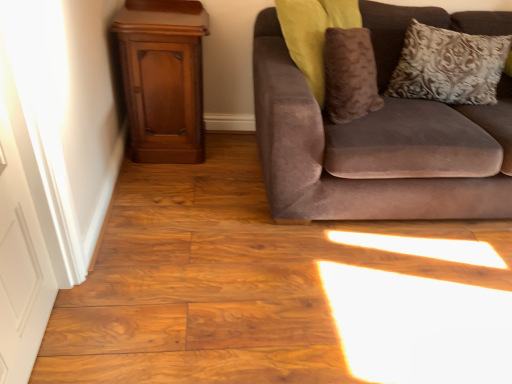
Locate an element on the screen. This screenshot has width=512, height=384. free spot below white painted wood door at left (from a real-world perspective) is located at coordinates (47, 337).